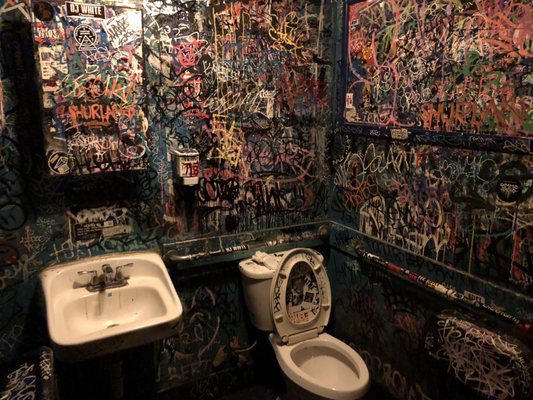
In order to click on back underside of toilet seat in this screenshot , I will do `click(303, 327)`.